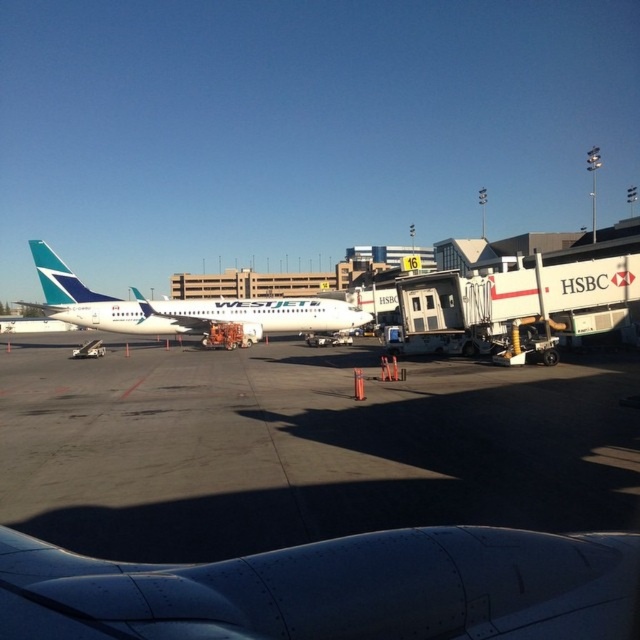
You are a passenger on the WestJet aircraft and want to exit the plane through the jet bridge. From your seat, you can see two points marked on the tarmac. Which point, point (150, 595) or point (83, 310), is closer to the jet bridge entrance?

Point (150, 595) is in front of point (83, 310), so it is closer to the jet bridge entrance.

You are a passenger on a plane and notice two objects outside your window. One is a metallic gray engine at lower center and the other is a white glossy airplane at center. Which object is positioned lower in the scene?

The metallic gray engine at lower center is positioned lower than the white glossy airplane at center.

You are a maintenance worker needing to access the metallic gray engine at lower center and the white glossy airplane at center. Which object requires more space to work around due to its size?

The white glossy airplane at center requires more space to work around because it is wider than the metallic gray engine at lower center.